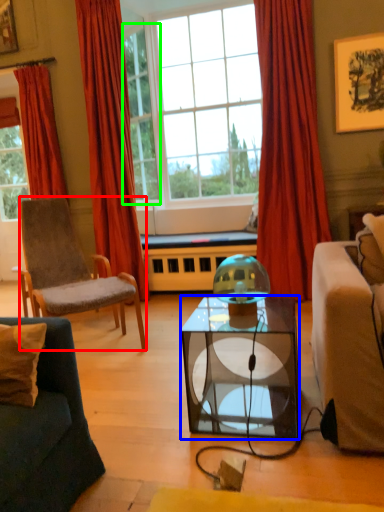
Question: Which is nearer to the chair (highlighted by a red box)? coffee table (highlighted by a blue box) or window (highlighted by a green box).

Choices:
 (A) coffee table
 (B) window

Answer: (A)